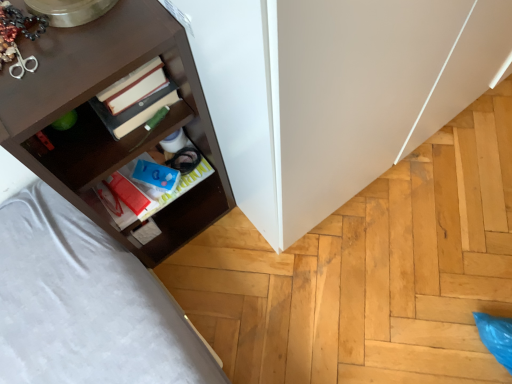
The width and height of the screenshot is (512, 384). I want to click on matte blue book at center, so click(x=148, y=187).

Describe the element at coordinates (148, 187) in the screenshot. I see `matte blue book at center` at that location.

In order to face dark brown wood shelf at left, should I rotate leftwards or rightwards?

To face it directly, rotate left by 16.094 degrees.

Identify the location of dark brown wood shelf at left. (102, 122).

This screenshot has width=512, height=384. What do you see at coordinates (102, 122) in the screenshot?
I see `dark brown wood shelf at left` at bounding box center [102, 122].

The width and height of the screenshot is (512, 384). Identify the location of matte blue book at center. (148, 187).

Considering the positions of objects dark brown wood shelf at left and matte blue book at center in the image provided, who is more to the right, dark brown wood shelf at left or matte blue book at center?

matte blue book at center.

Is the position of dark brown wood shelf at left more distant than that of matte blue book at center?

No, dark brown wood shelf at left is in front of matte blue book at center.

Which is behind, point (32, 91) or point (157, 200)?

Point (157, 200)

From the image's perspective, which is below, dark brown wood shelf at left or matte blue book at center?

matte blue book at center appears lower in the image.

From a real-world perspective, who is located higher, dark brown wood shelf at left or matte blue book at center?

In real-world perspective, dark brown wood shelf at left is above.

Considering the sizes of objects dark brown wood shelf at left and matte blue book at center in the image provided, who is thinner, dark brown wood shelf at left or matte blue book at center?

matte blue book at center is thinner.

Does dark brown wood shelf at left have a greater height compared to matte blue book at center?

Yes, dark brown wood shelf at left is taller than matte blue book at center.

Does dark brown wood shelf at left have a smaller size compared to matte blue book at center?

Incorrect, dark brown wood shelf at left is not smaller in size than matte blue book at center.

Is matte blue book at center located within dark brown wood shelf at left?

Yes, matte blue book at center is inside dark brown wood shelf at left.

Is dark brown wood shelf at left positioned far away from matte blue book at center?

No, there isn't a large distance between dark brown wood shelf at left and matte blue book at center.

Is dark brown wood shelf at left oriented away from matte blue book at center?

That's right, dark brown wood shelf at left is facing away from matte blue book at center.

Where is `shelf that is above the matte blue book at center (from the image's perspective)`? The image size is (512, 384). shelf that is above the matte blue book at center (from the image's perspective) is located at coordinates (102, 122).

Which object is positioned more to the right, matte blue book at center or dark brown wood shelf at left?

From the viewer's perspective, matte blue book at center appears more on the right side.

Considering the positions of objects matte blue book at center and dark brown wood shelf at left in the image provided, who is in front, matte blue book at center or dark brown wood shelf at left?

dark brown wood shelf at left is closer to the camera.

Considering the positions of points (133, 221) and (144, 55), is point (133, 221) closer to camera compared to point (144, 55)?

No, it is not.

From the image's perspective, is matte blue book at center under dark brown wood shelf at left?

Indeed, from the image's perspective, matte blue book at center is shown beneath dark brown wood shelf at left.

From a real-world perspective, which object rests below the other?

matte blue book at center.

Looking at their sizes, would you say matte blue book at center is wider or thinner than dark brown wood shelf at left?

Clearly, matte blue book at center has less width compared to dark brown wood shelf at left.

Based on the photo, considering the sizes of matte blue book at center and dark brown wood shelf at left in the image, is matte blue book at center taller or shorter than dark brown wood shelf at left?

matte blue book at center is shorter than dark brown wood shelf at left.

Based on the photo, can you confirm if matte blue book at center is bigger than dark brown wood shelf at left?

No, matte blue book at center is not bigger than dark brown wood shelf at left.

Can we say matte blue book at center lies outside dark brown wood shelf at left?

No, matte blue book at center is inside or overlapping with dark brown wood shelf at left.

Are matte blue book at center and dark brown wood shelf at left making contact?

No, matte blue book at center is not beside dark brown wood shelf at left.

Is matte blue book at center facing towards dark brown wood shelf at left?

Yes, matte blue book at center is aimed at dark brown wood shelf at left.

How far apart are matte blue book at center and dark brown wood shelf at left?

They are 21.11 centimeters apart.

The image size is (512, 384). I want to click on shelf that appears above the matte blue book at center (from the image's perspective), so click(x=102, y=122).

At what (x,y) coordinates should I click in order to perform the action: click on book on the right of dark brown wood shelf at left. Please return your answer as a coordinate pair (x, y). This screenshot has width=512, height=384. Looking at the image, I should click on (148, 187).

This screenshot has height=384, width=512. Find the location of `shelf above the matte blue book at center (from a real-world perspective)`. shelf above the matte blue book at center (from a real-world perspective) is located at coordinates (102, 122).